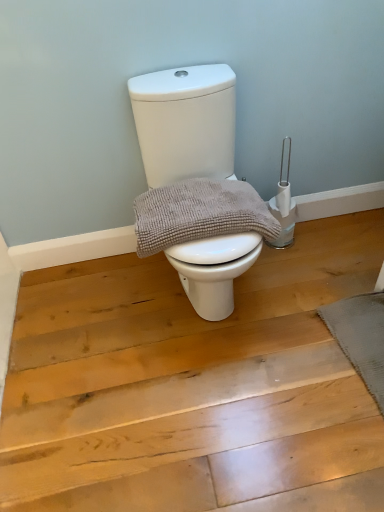
Question: Does white matte toilet at center have a larger size compared to gray textured towel at center?

Choices:
 (A) yes
 (B) no

Answer: (A)

Question: From the image's perspective, is white matte toilet at center under gray textured towel at center?

Choices:
 (A) yes
 (B) no

Answer: (B)

Question: Is white matte toilet at center at the left side of gray textured towel at center?

Choices:
 (A) no
 (B) yes

Answer: (A)

Question: Is white matte toilet at center further to camera compared to gray textured towel at center?

Choices:
 (A) yes
 (B) no

Answer: (B)

Question: Is white matte toilet at center not inside gray textured towel at center?

Choices:
 (A) no
 (B) yes

Answer: (B)

Question: Is white matte toilet at center facing away from gray textured towel at center?

Choices:
 (A) no
 (B) yes

Answer: (B)

Question: Is gray textured towel at center oriented towards white matte toilet at center?

Choices:
 (A) yes
 (B) no

Answer: (A)

Question: Is gray textured towel at center closer to camera compared to white matte toilet at center?

Choices:
 (A) yes
 (B) no

Answer: (B)

Question: Is gray textured towel at center outside white matte toilet at center?

Choices:
 (A) no
 (B) yes

Answer: (A)

Question: Is gray textured towel at center taller than white matte toilet at center?

Choices:
 (A) yes
 (B) no

Answer: (B)

Question: Considering the relative sizes of gray textured towel at center and white matte toilet at center in the image provided, is gray textured towel at center wider than white matte toilet at center?

Choices:
 (A) yes
 (B) no

Answer: (B)

Question: Is gray textured towel at center looking in the opposite direction of white matte toilet at center?

Choices:
 (A) no
 (B) yes

Answer: (B)

Question: Is point (188, 120) closer or farther from the camera than point (152, 251)?

Choices:
 (A) farther
 (B) closer

Answer: (A)